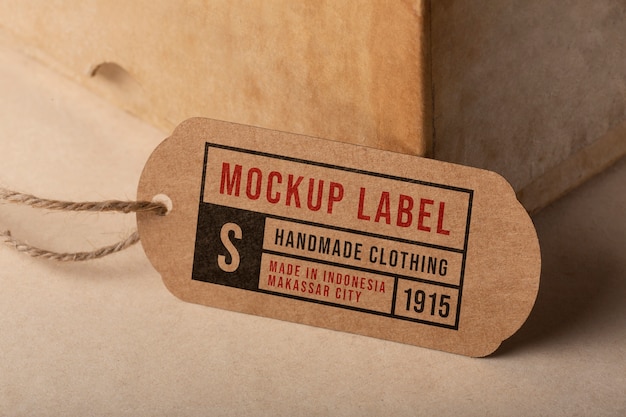
Locate an element on the screen. countertop is located at coordinates (337, 359).